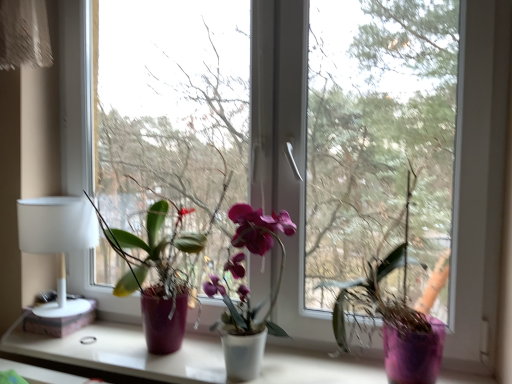
Identify the location of vacant space underneath matte purple pot at left, the 1th houseplant from the left (from a real-world perspective). (133, 355).